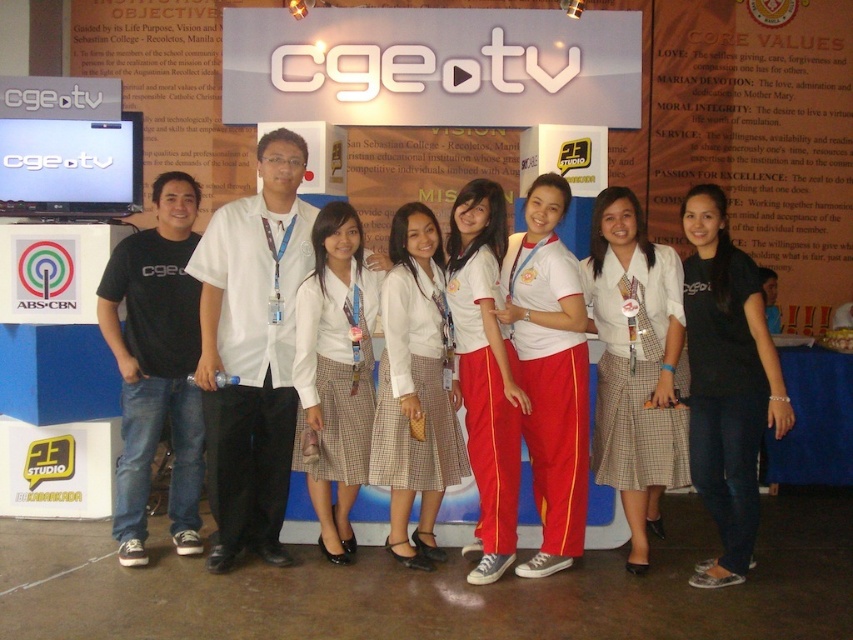
Is point (338, 340) less distant than point (492, 205)?

No, it is behind (492, 205).

Can you confirm if white plaid skirt at center is positioned above white cotton pants at center?

No.

Between point (320, 273) and point (491, 320), which one is positioned behind?

Positioned behind is point (320, 273).

Identify the location of white plaid skirt at center. (335, 372).

Does white woven skirt at center appear on the left side of black cotton shirt at right?

Yes, white woven skirt at center is to the left of black cotton shirt at right.

Between point (679, 378) and point (699, 340), which one is positioned in front?

Point (699, 340) is more forward.

The width and height of the screenshot is (853, 640). Identify the location of white woven skirt at center. (635, 365).

Who is taller, white woven skirt at center or plaid skirt at center?

white woven skirt at center is taller.

Can you confirm if white woven skirt at center is positioned above plaid skirt at center?

Indeed, white woven skirt at center is positioned over plaid skirt at center.

Which is in front, point (648, 488) or point (434, 289)?

Point (434, 289) is more forward.

Locate an element on the screen. The width and height of the screenshot is (853, 640). white woven skirt at center is located at coordinates (635, 365).